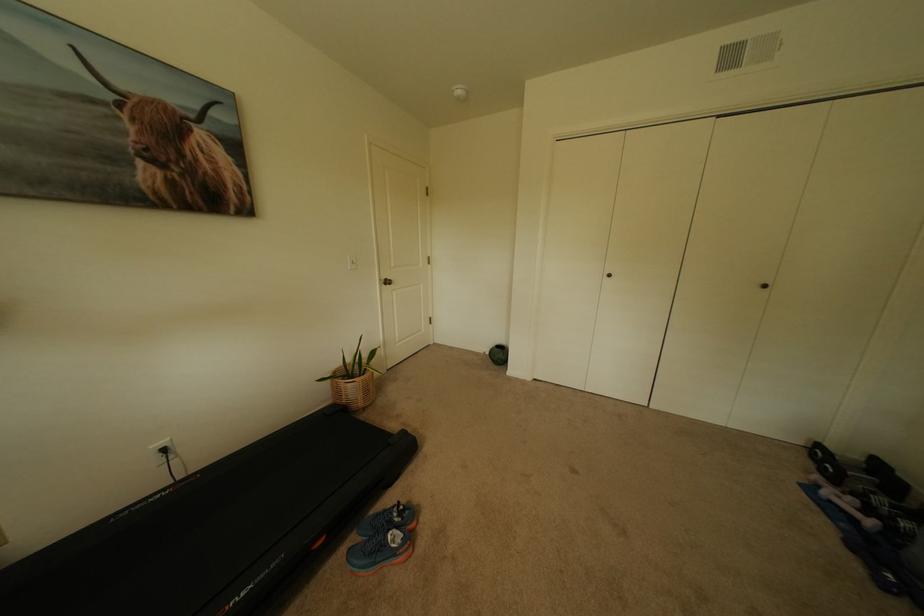
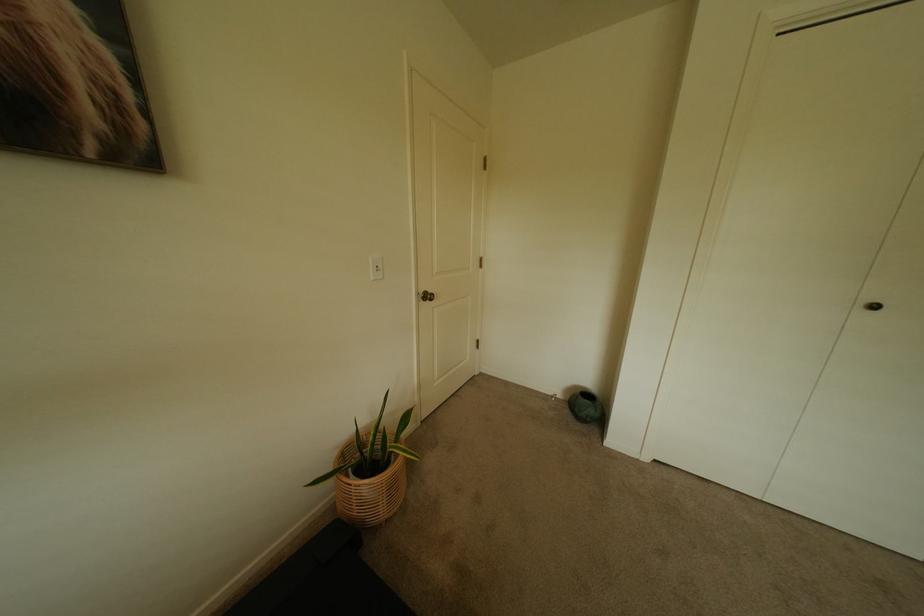
Looking at this image, what movement of the cameraman would produce the second image?

The cameraman walked toward left, forward.